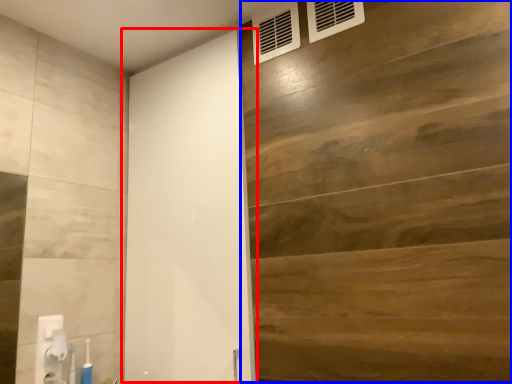
Question: Which point is closer to the camera, barn door (highlighted by a red box) or plywood (highlighted by a blue box)?

Choices:
 (A) barn door
 (B) plywood

Answer: (B)